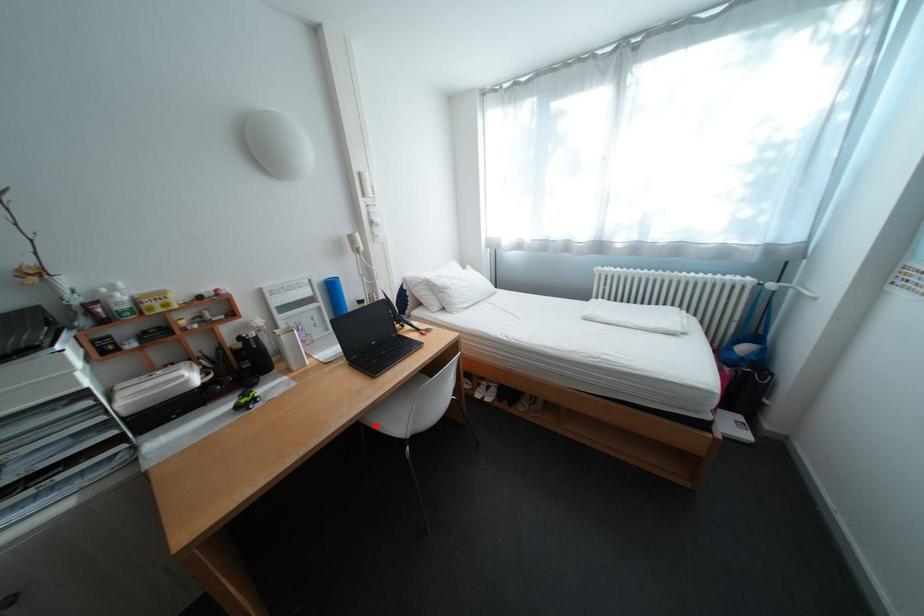
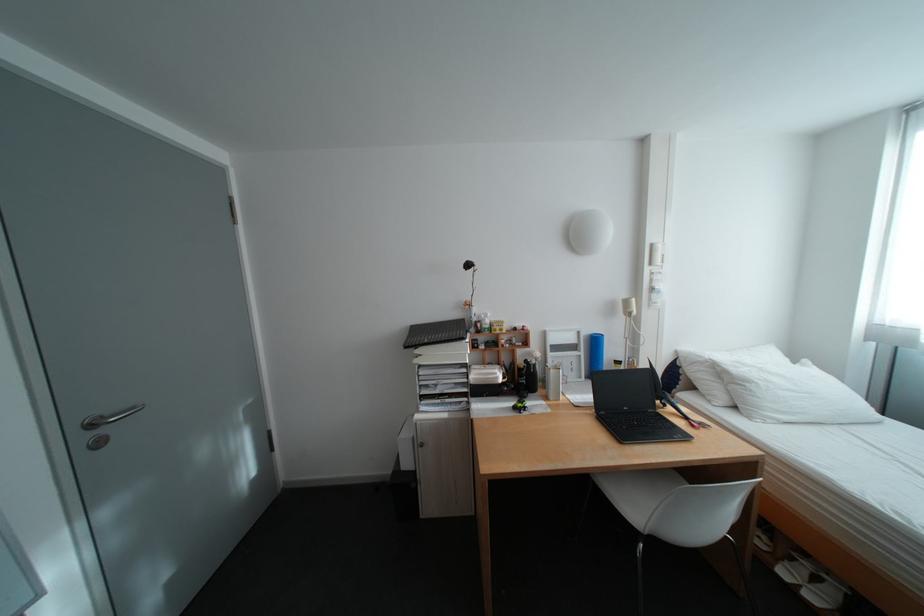
Question: I am providing you with two images of the same scene from different viewpoints. Image1 has a red point marked. In image2, the corresponding 3D location appears at what relative position? Reply with the corresponding letter.

Choices:
 (A) Closer
 (B) Farther

Answer: (A)